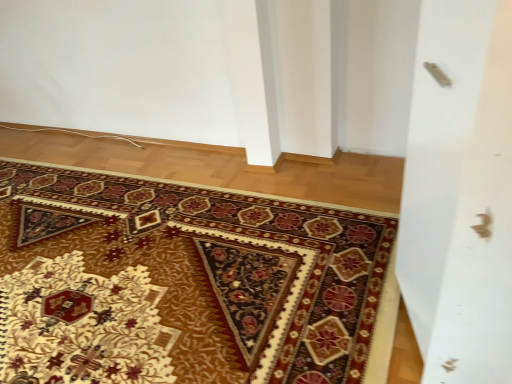
Image resolution: width=512 pixels, height=384 pixels. Find the location of `free space above carpet with intricate patterns at center (from a real-world perspective)`. free space above carpet with intricate patterns at center (from a real-world perspective) is located at coordinates (108, 286).